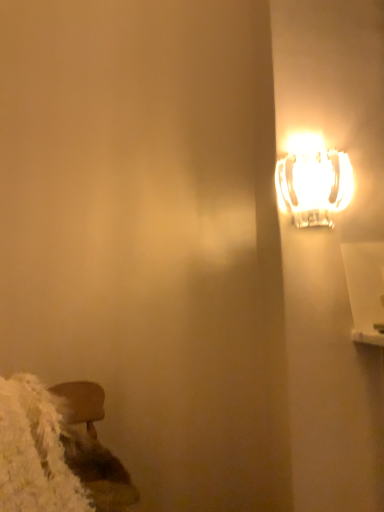
Question: Considering the relative positions of wooden stool at lower left and translucent glass lamp at upper right in the image provided, is wooden stool at lower left to the left or to the right of translucent glass lamp at upper right?

Choices:
 (A) left
 (B) right

Answer: (A)

Question: In terms of height, does wooden stool at lower left look taller or shorter compared to translucent glass lamp at upper right?

Choices:
 (A) short
 (B) tall

Answer: (B)

Question: From the image's perspective, is wooden stool at lower left positioned above or below translucent glass lamp at upper right?

Choices:
 (A) below
 (B) above

Answer: (A)

Question: From the image's perspective, is translucent glass lamp at upper right positioned above or below wooden stool at lower left?

Choices:
 (A) below
 (B) above

Answer: (B)

Question: Is translucent glass lamp at upper right in front of or behind wooden stool at lower left in the image?

Choices:
 (A) behind
 (B) front

Answer: (A)

Question: Would you say translucent glass lamp at upper right is to the left or to the right of wooden stool at lower left in the picture?

Choices:
 (A) right
 (B) left

Answer: (A)

Question: Looking at the image, does translucent glass lamp at upper right seem bigger or smaller compared to wooden stool at lower left?

Choices:
 (A) small
 (B) big

Answer: (A)